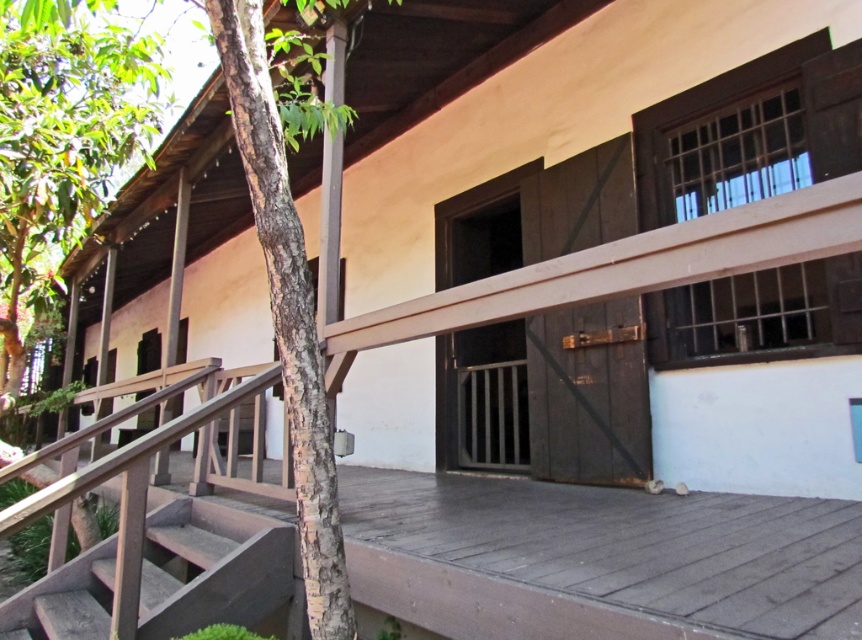
You are standing on the wooden staircase leading up to the porch and want to know which tree is closer to you between the green leafy tree at left and the brown textured tree at left. Based on their sizes, can you determine which one is nearer?

The green leafy tree at left has a smaller size compared to the brown textured tree at left, so the smaller green leafy tree at left is closer to you since objects closer appear smaller in this perspective.

Based on the photo, you are standing on the wooden stairs at lower left and want to move towards the brown textured tree at left. In which direction should you go?

The brown textured tree at left is to the right of wooden stairs at lower left, so you should move to the right to reach it.

You are a delivery person trying to park your 10 feet wide delivery van between the green leafy tree at left and the brown rough bark tree at center. Can you fit the van between them?

The distance between the green leafy tree at left and the brown rough bark tree at center is 19.67 feet, which is wider than the van. Therefore, the van can be parked between them.